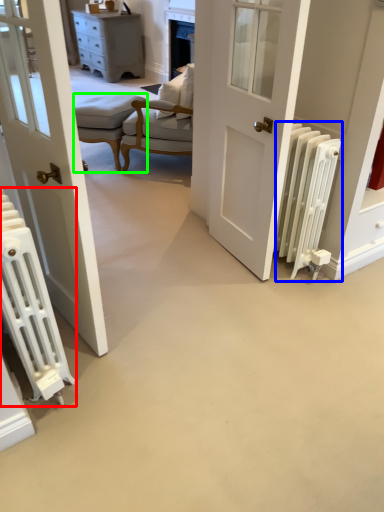
Question: Which object is the closest to the radiator (highlighted by a red box)? Choose among these: radiator (highlighted by a blue box) or stool (highlighted by a green box).

Choices:
 (A) radiator
 (B) stool

Answer: (A)